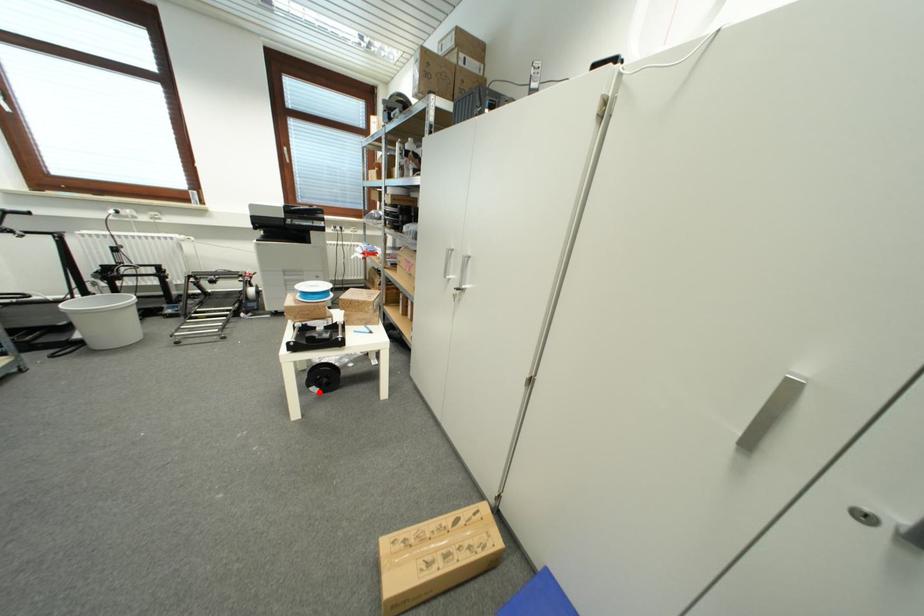
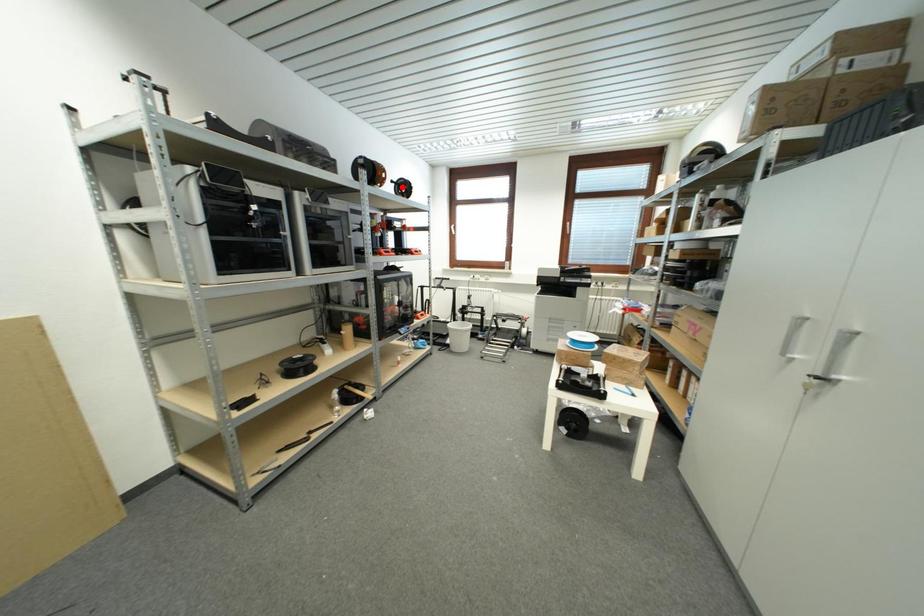
I am providing you with two images of the same scene from different viewpoints. A red point is marked on the first image and another point is marked on the second image. Is the red point in image1 aligned with the point shown in image2?

No